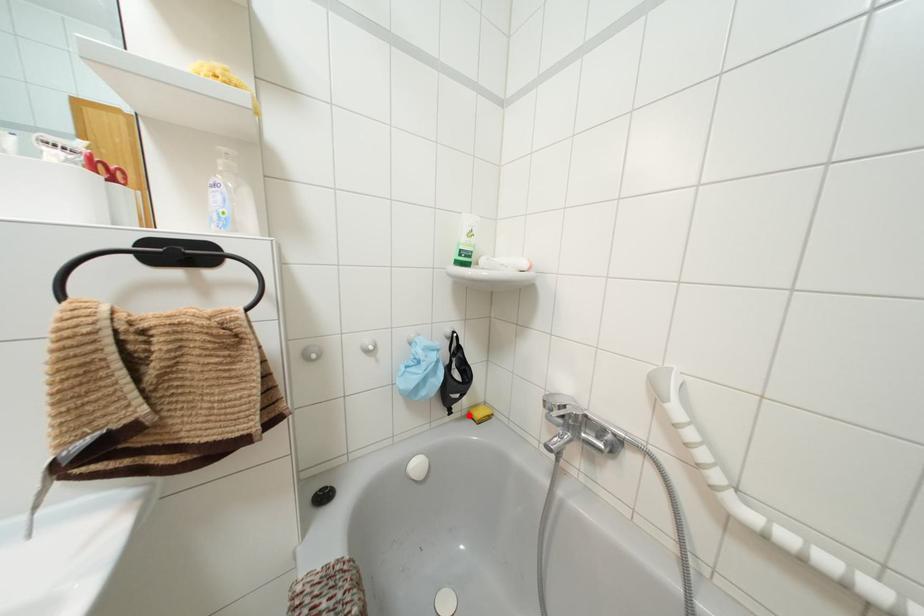
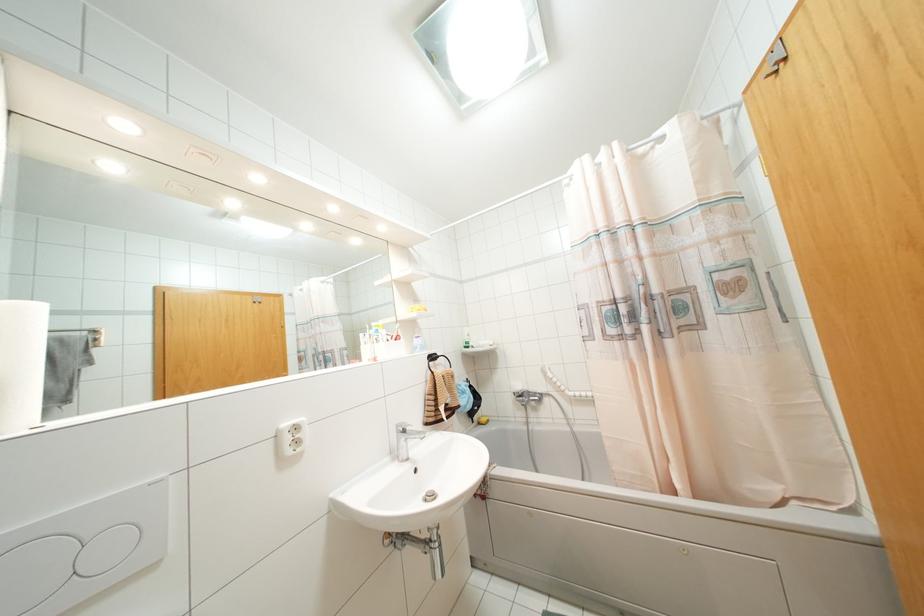
In the second image, find the point that corresponds to the highlighted location in the first image.

(479, 423)